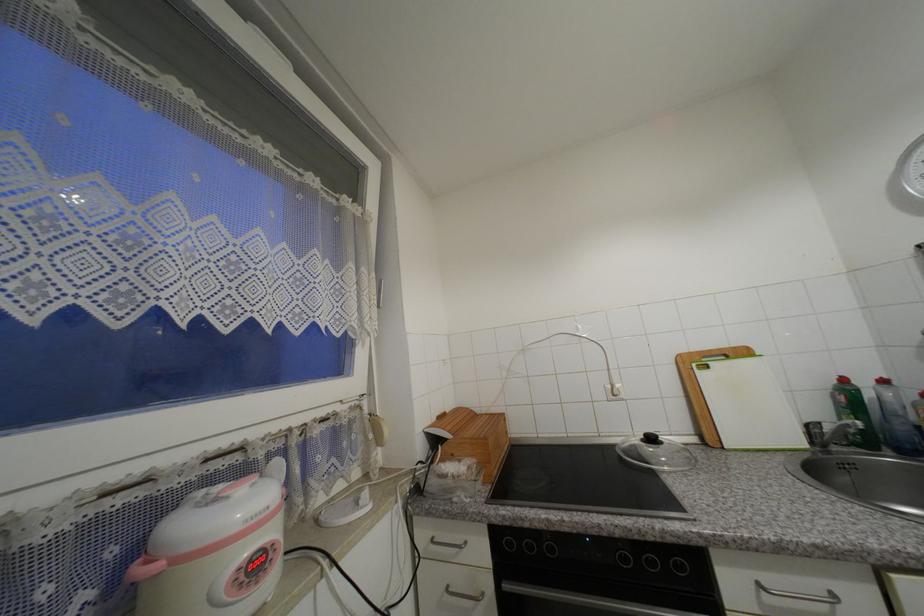
Describe the element at coordinates (144, 569) in the screenshot. The width and height of the screenshot is (924, 616). I see `a pink rice cooker handle` at that location.